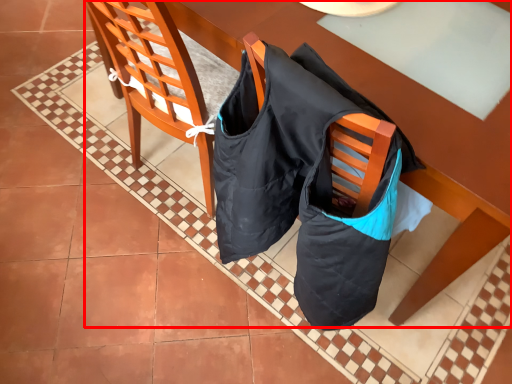
Question: From the image, what is the correct spatial relationship of table (annotated by the red box) in relation to chair?

Choices:
 (A) left
 (B) right

Answer: (B)